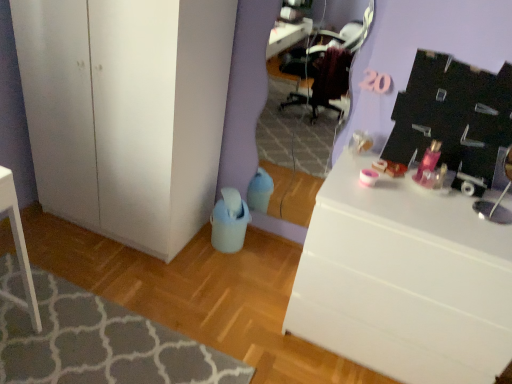
Question: From a real-world perspective, is matte purple mirror at center on top of textured gray rug at lower left?

Choices:
 (A) yes
 (B) no

Answer: (A)

Question: Is matte purple mirror at center located outside textured gray rug at lower left?

Choices:
 (A) yes
 (B) no

Answer: (A)

Question: Are matte purple mirror at center and textured gray rug at lower left making contact?

Choices:
 (A) no
 (B) yes

Answer: (A)

Question: Does matte purple mirror at center appear on the right side of textured gray rug at lower left?

Choices:
 (A) yes
 (B) no

Answer: (A)

Question: Is matte purple mirror at center positioned far away from textured gray rug at lower left?

Choices:
 (A) no
 (B) yes

Answer: (B)

Question: From the image's perspective, relative to white matte cabinet at lower left, is textured gray rug at lower left above or below?

Choices:
 (A) below
 (B) above

Answer: (A)

Question: Is textured gray rug at lower left situated inside white matte cabinet at lower left or outside?

Choices:
 (A) outside
 (B) inside

Answer: (A)

Question: Is textured gray rug at lower left in front of or behind white matte cabinet at lower left in the image?

Choices:
 (A) behind
 (B) front

Answer: (B)

Question: In terms of size, does textured gray rug at lower left appear bigger or smaller than white matte cabinet at lower left?

Choices:
 (A) big
 (B) small

Answer: (B)

Question: From the image's perspective, relative to white matte cabinet at lower left, is white glossy desk at right above or below?

Choices:
 (A) below
 (B) above

Answer: (A)

Question: In terms of width, does white glossy desk at right look wider or thinner when compared to white matte cabinet at lower left?

Choices:
 (A) thin
 (B) wide

Answer: (A)

Question: Does point (476, 314) appear closer or farther from the camera than point (165, 200)?

Choices:
 (A) farther
 (B) closer

Answer: (B)

Question: Relative to white matte cabinet at lower left, is white glossy desk at right in front or behind?

Choices:
 (A) behind
 (B) front

Answer: (B)

Question: From a real-world perspective, relative to white glossy desk at right, is matte purple mirror at center vertically above or below?

Choices:
 (A) above
 (B) below

Answer: (A)

Question: Is matte purple mirror at center spatially inside white glossy desk at right, or outside of it?

Choices:
 (A) outside
 (B) inside

Answer: (A)